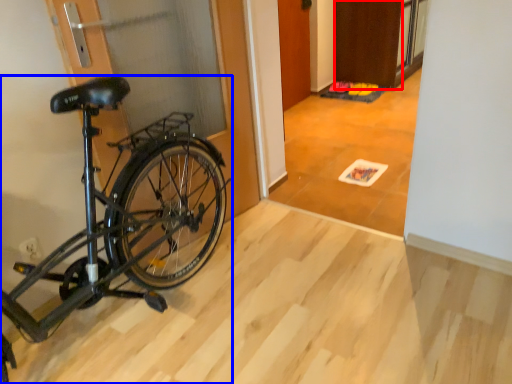
Question: Which object appears farthest to the camera in this image, door (highlighted by a red box) or bicycle (highlighted by a blue box)?

Choices:
 (A) door
 (B) bicycle

Answer: (A)